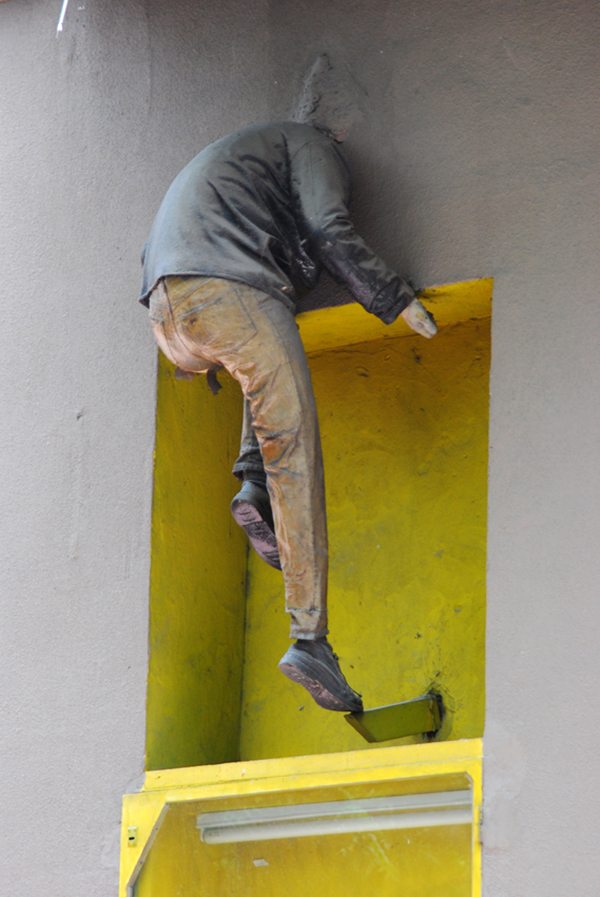
At what (x,y) coordinates should I click in order to perform the action: click on seat pockets. Please return your answer as a coordinate pair (x, y). The width and height of the screenshot is (600, 897). Looking at the image, I should click on (154, 331), (215, 320).